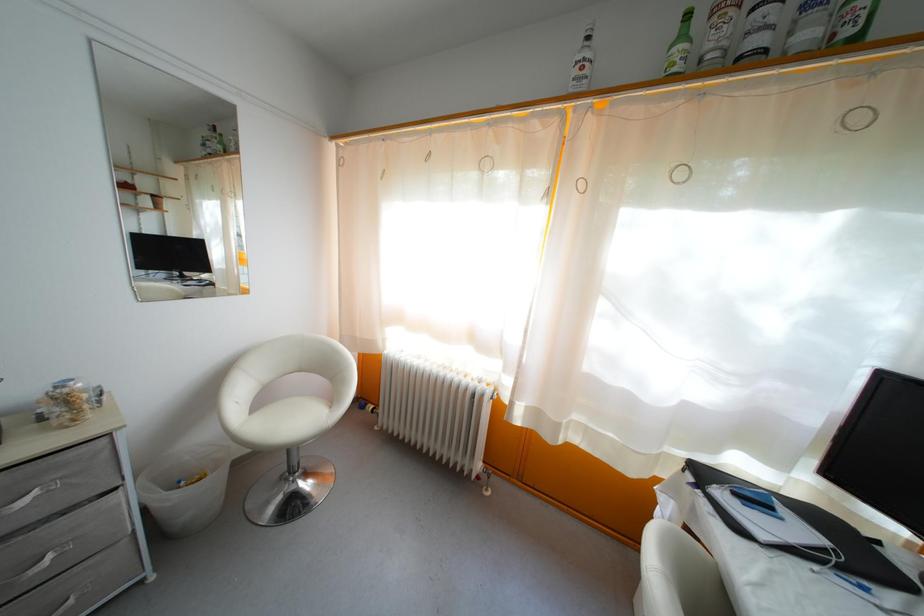
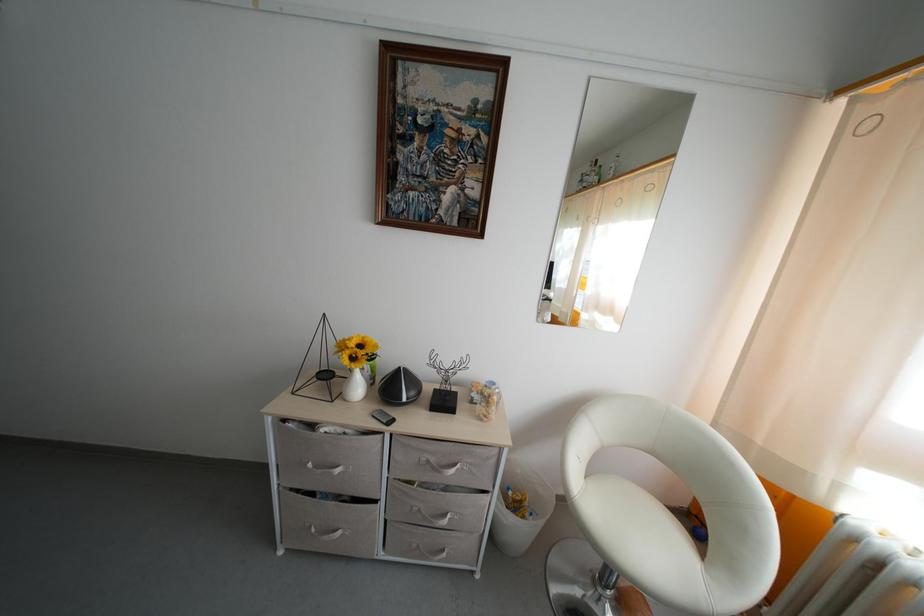
Locate, in the second image, the point that corresponds to (70,406) in the first image.

(493, 406)